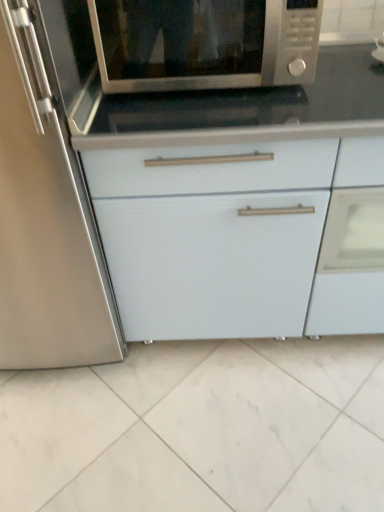
Where is `free space in front of white matte cabinet at center`? The height and width of the screenshot is (512, 384). free space in front of white matte cabinet at center is located at coordinates (265, 423).